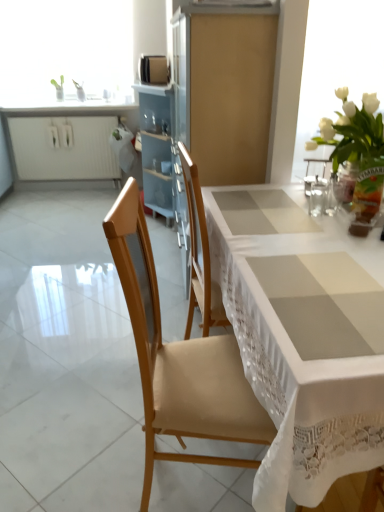
Question: In terms of size, does clear glass water at upper right appear bigger or smaller than white glass vase at upper left?

Choices:
 (A) big
 (B) small

Answer: (B)

Question: Is clear glass water at upper right spatially inside white glass vase at upper left, or outside of it?

Choices:
 (A) inside
 (B) outside

Answer: (B)

Question: Estimate the real-world distances between objects in this image. Which object is closer to the white porcelain vase at upper right?

Choices:
 (A) white lace tablecloth at center
 (B) white matte cabinet at upper left
 (C) white glass vase at upper left
 (D) satin gold microwave at upper center
 (E) white glossy countertop at upper left

Answer: (A)

Question: Which object is positioned closest to the green glass vase at upper right?

Choices:
 (A) white lace tablecloth at center
 (B) wooden chair at center
 (C) satin gold microwave at upper center
 (D) white porcelain vase at upper right
 (E) white glass vase at upper left

Answer: (D)